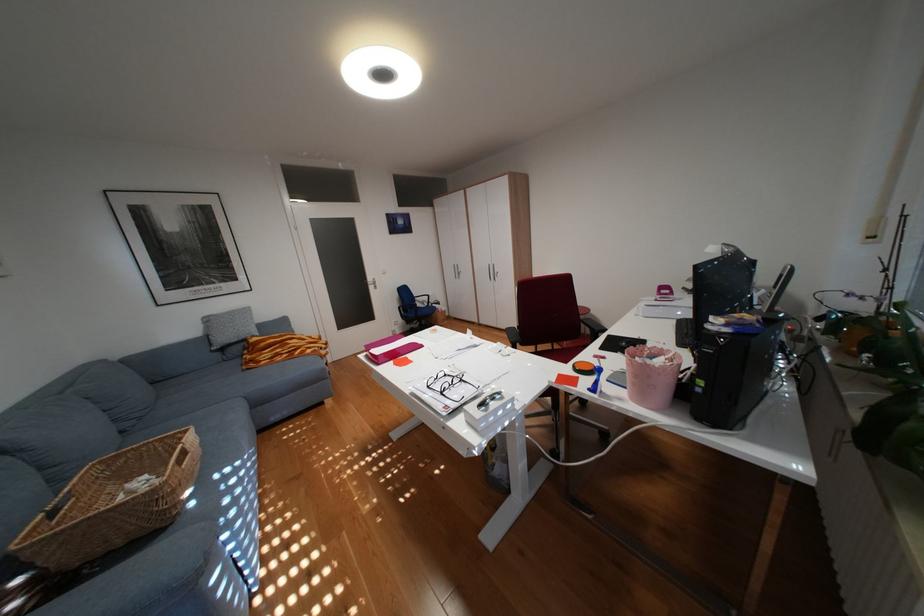
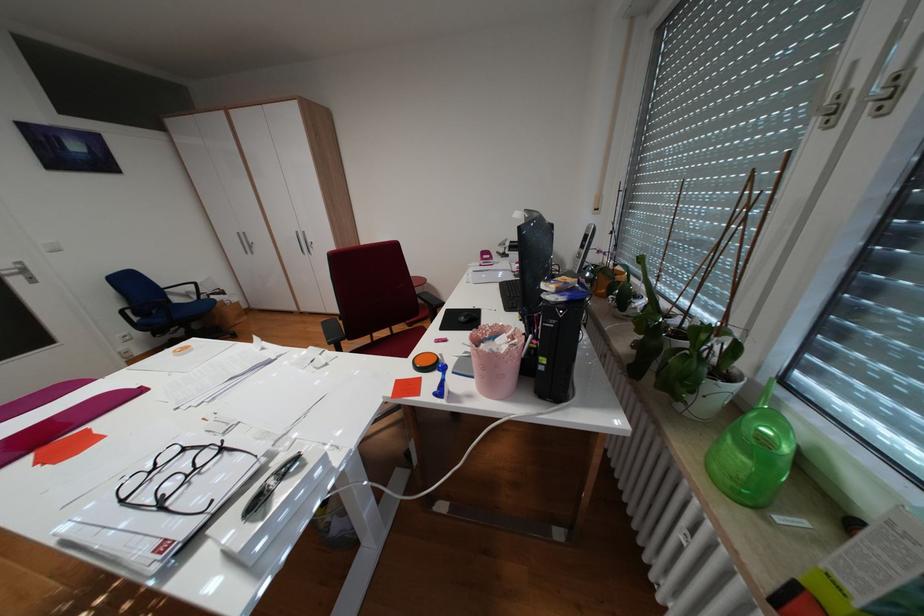
Locate, in the second image, the point that corresponds to (570,345) in the first image.

(408, 329)